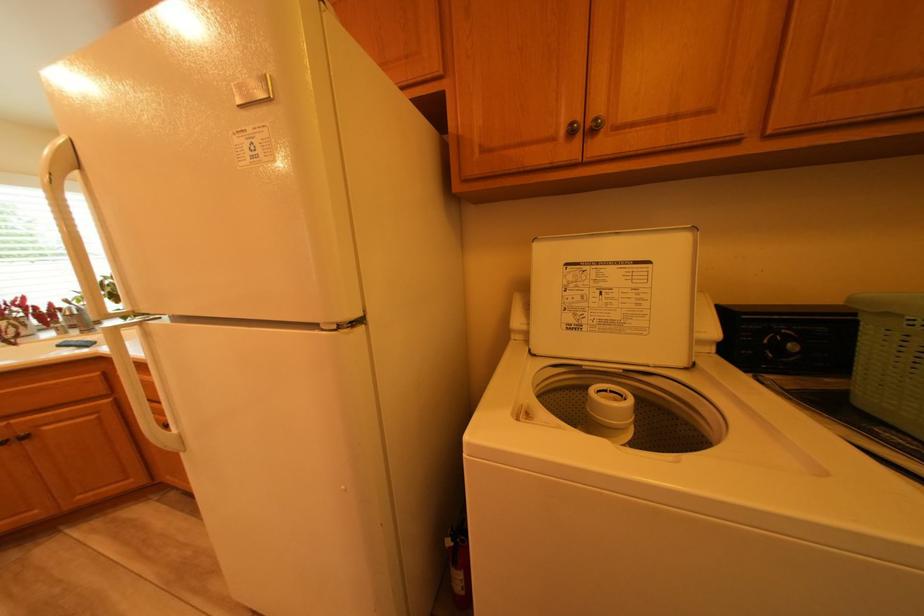
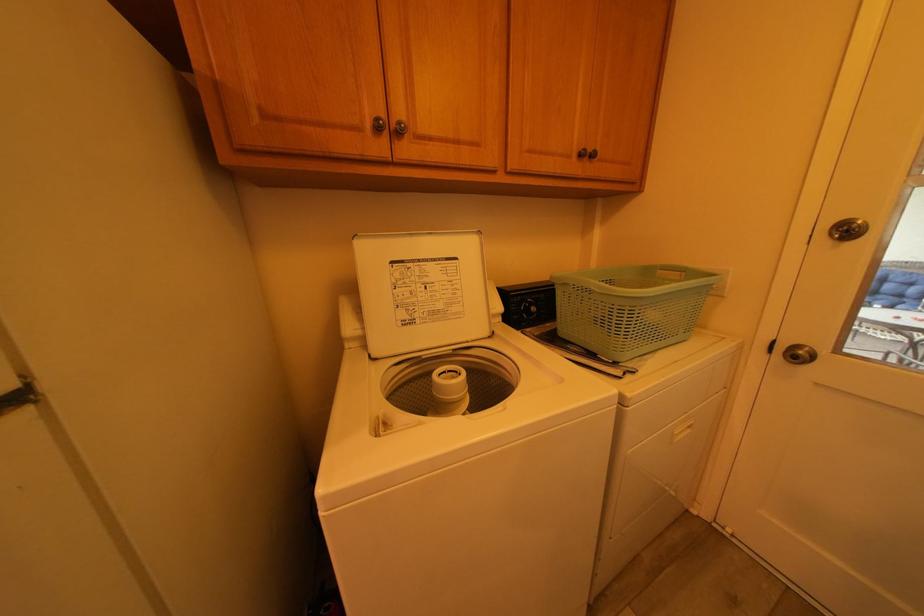
Locate, in the second image, the point that corresponds to (x=602, y=124) in the first image.

(407, 126)